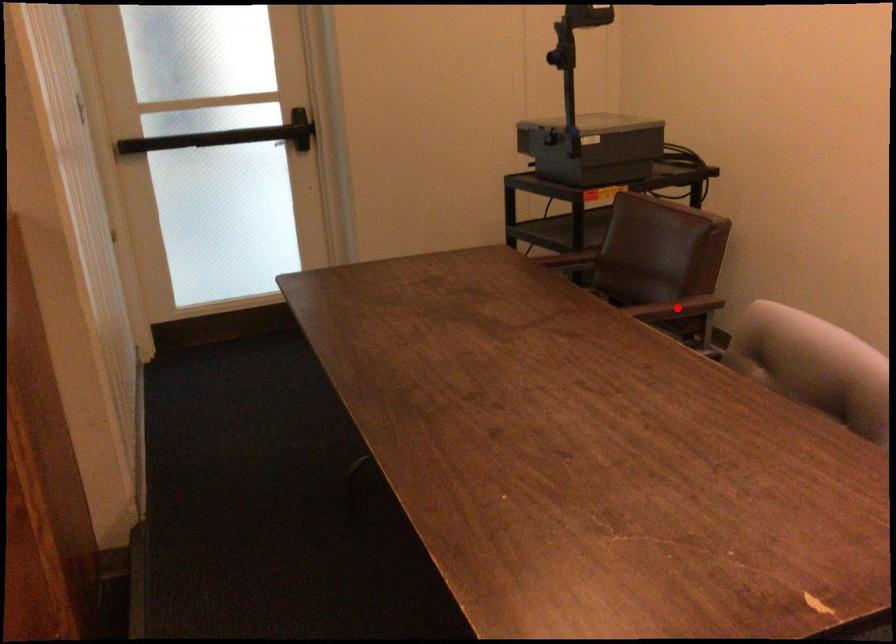
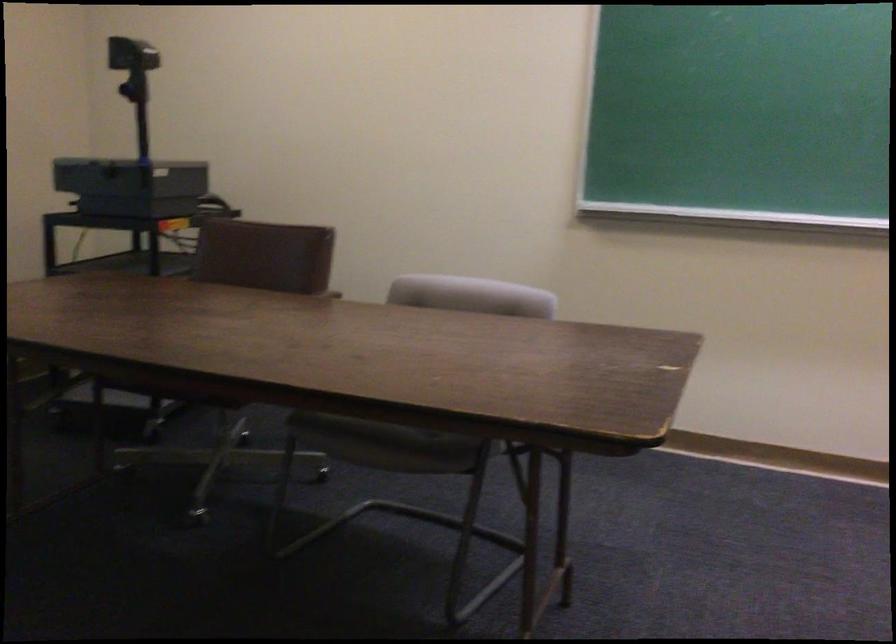
Question: I am providing you with two images of the same scene from different viewpoints. A red point is marked on the first image. Is the red point's position out of view in image 2?

Choices:
 (A) Yes
 (B) No

Answer: (A)